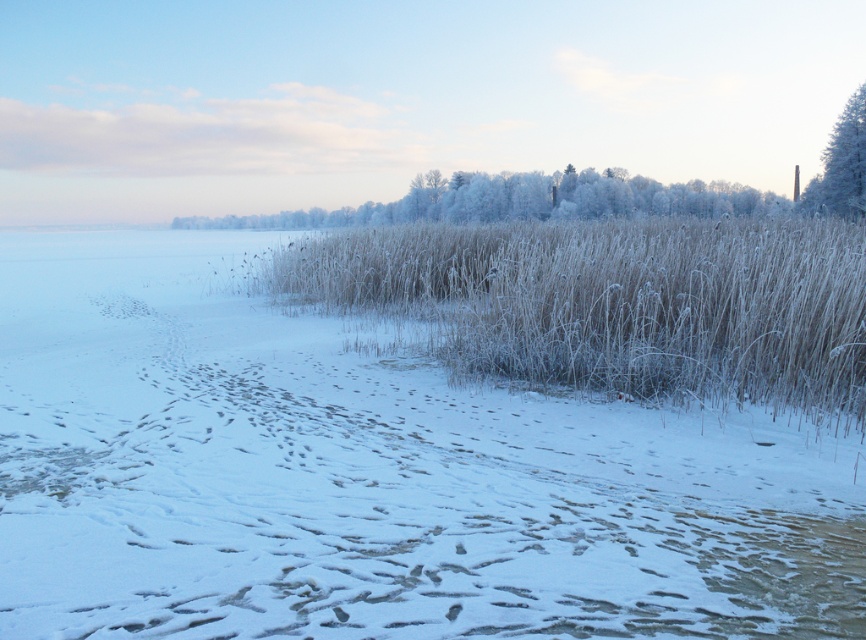
Does white frosty grass at center have a greater height compared to white frosty tree at upper right?

No, white frosty grass at center is not taller than white frosty tree at upper right.

Does point (460, 438) lie in front of point (793, 184)?

Yes, point (460, 438) is in front of point (793, 184).

Image resolution: width=866 pixels, height=640 pixels. What are the coordinates of `white frosty grass at center` in the screenshot? It's located at (370, 477).

Can you confirm if frosted grass at center is positioned to the left of white frosty tree at upper right?

Correct, you'll find frosted grass at center to the left of white frosty tree at upper right.

Between frosted grass at center and white frosty tree at upper right, which one has more height?

Standing taller between the two is white frosty tree at upper right.

Consider the image. Measure the distance between point [634,387] and camera.

The distance of point [634,387] from camera is 34.90 feet.

Where is `frosted grass at center`? The width and height of the screenshot is (866, 640). frosted grass at center is located at coordinates (614, 301).

Is white frosty grass at center positioned in front of frosted grass at center?

Yes, white frosty grass at center is in front of frosted grass at center.

What do you see at coordinates (370, 477) in the screenshot?
I see `white frosty grass at center` at bounding box center [370, 477].

The image size is (866, 640). What are the coordinates of `white frosty grass at center` in the screenshot? It's located at (370, 477).